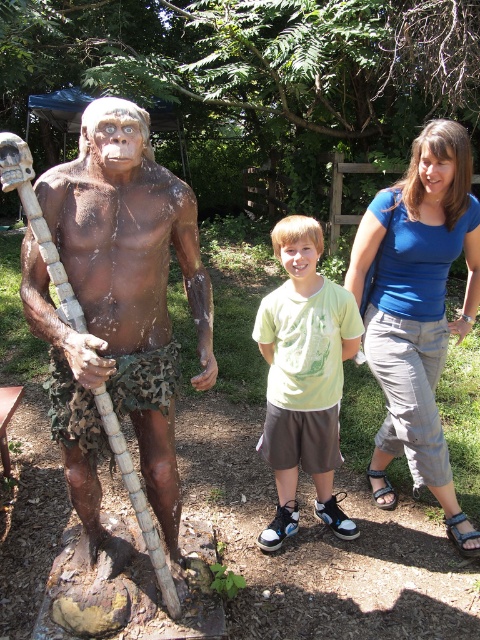
Question: In this image, where is blue cotton shirt at upper right located relative to green cotton shirt at center?

Choices:
 (A) above
 (B) below

Answer: (A)

Question: Which object is closer to the camera taking this photo?

Choices:
 (A) blue cotton shirt at upper right
 (B) brown matte statue at left
 (C) green cotton shirt at center

Answer: (B)

Question: Does brown matte statue at left have a larger size compared to green cotton shirt at center?

Choices:
 (A) no
 (B) yes

Answer: (B)

Question: Considering the real-world distances, which object is farthest from the blue cotton shirt at upper right?

Choices:
 (A) green cotton shirt at center
 (B) brown matte statue at left

Answer: (B)

Question: Observing the image, what is the correct spatial positioning of brown matte statue at left in reference to blue cotton shirt at upper right?

Choices:
 (A) left
 (B) right

Answer: (A)

Question: Which point is closer to the camera?

Choices:
 (A) (169, 541)
 (B) (432, 253)

Answer: (A)